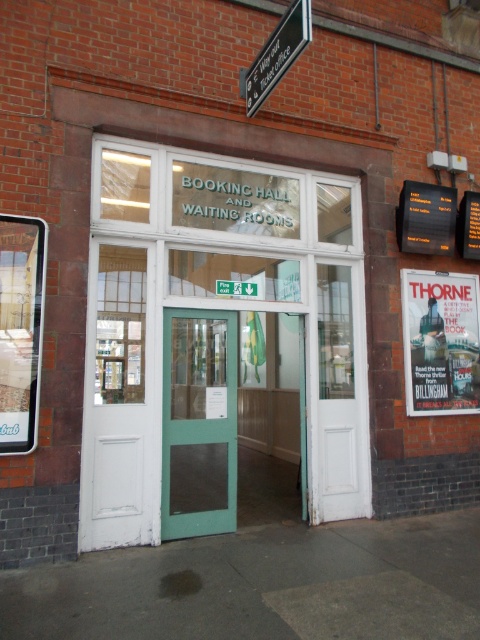
Question: Which of the following is the farthest from the observer?

Choices:
 (A) (285, 58)
 (B) (82, 452)
 (C) (442, 292)

Answer: (C)

Question: Which object is the closest to the matte paper poster at right?

Choices:
 (A) metallic sign at upper center
 (B) green matte door at center
 (C) white wooden door at left

Answer: (B)

Question: Which point is farther from the camera taking this photo?

Choices:
 (A) (216, 385)
 (B) (240, 74)
 (C) (130, 451)

Answer: (B)

Question: Is matte paper poster at right bigger than metallic sign at upper center?

Choices:
 (A) no
 (B) yes

Answer: (B)

Question: Considering the relative positions of green matte door at center and metallic sign at upper center in the image provided, where is green matte door at center located with respect to metallic sign at upper center?

Choices:
 (A) above
 (B) below

Answer: (B)

Question: Does white wooden door at center appear over metallic sign at upper center?

Choices:
 (A) yes
 (B) no

Answer: (B)